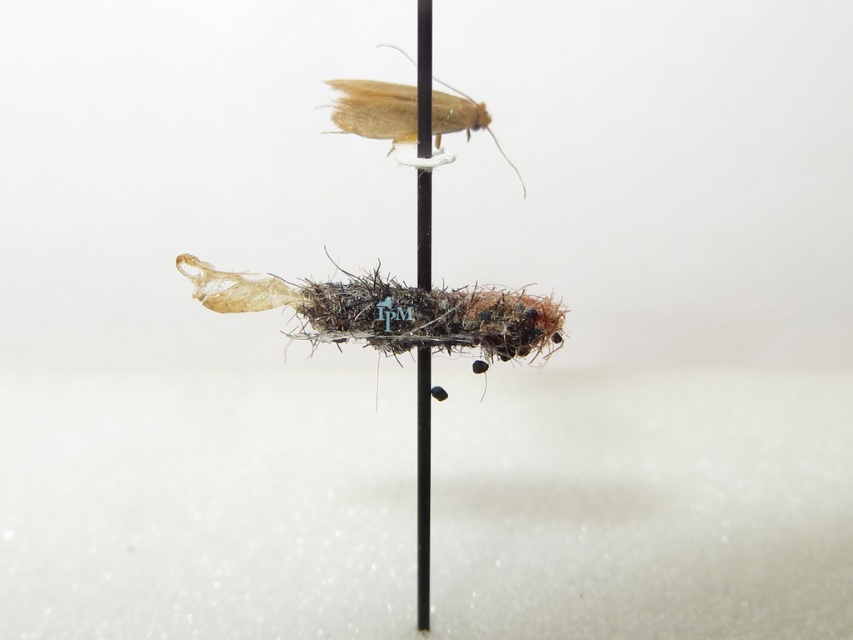
You are an entomologist examining the specimen. You need to determine which part of the specimen is wider. Which one is wider between the fuzzy brown caterpillar at center and the translucent beige moth at upper center?

The fuzzy brown caterpillar at center is wider than the translucent beige moth at upper center.

You are an entomologist examining the specimen. The coordinates of the fuzzy brown caterpillar at center are given as point (x=392, y=312). If you want to locate the moth part of the specimen, should you look above or below this point?

The fuzzy brown caterpillar at center is located at point (x=392, y=312). Since the moth is the top part of the specimen, you should look above this point to find the moth.